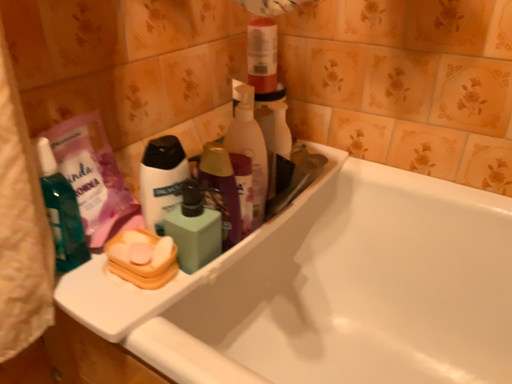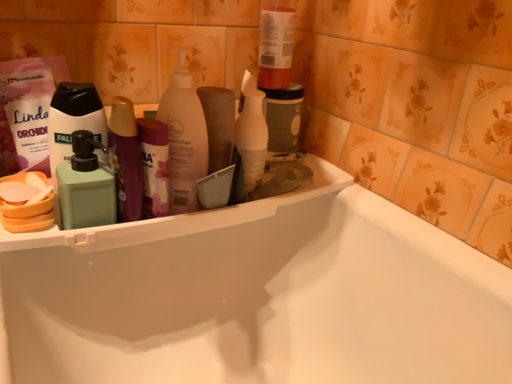
Question: How did the camera likely rotate when shooting the video?

Choices:
 (A) rotated left
 (B) rotated right

Answer: (A)